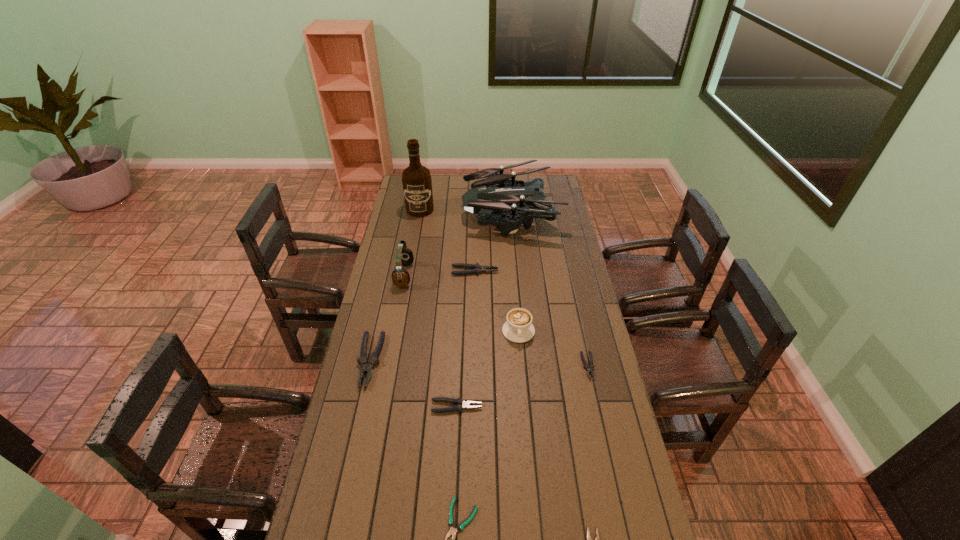
In order to click on blank area at the right edge in this screenshot , I will do `click(583, 279)`.

Locate an element on the screen. This screenshot has width=960, height=540. free space at the far left corner of the desktop is located at coordinates (401, 196).

At what (x,y) coordinates should I click in order to perform the action: click on vacant region between the drone and the fourth tallest object. Please return your answer as a coordinate pair (x, y). Looking at the image, I should click on (515, 272).

This screenshot has height=540, width=960. Identify the location of empty location between the drone and the cappuccino. (515, 272).

Image resolution: width=960 pixels, height=540 pixels. Find the location of `unoccupied position between the headset and the drone`. unoccupied position between the headset and the drone is located at coordinates (458, 244).

Image resolution: width=960 pixels, height=540 pixels. Identify the location of free area in between the nearest gray pliers and the alcohol. (439, 308).

Select which object appears as the seventh closest to the rightmost pliers. Please provide its 2D coordinates. Your answer should be formatted as a tuple, i.e. [(x, y)], where the tuple contains the x and y coordinates of a point satisfying the conditions above.

[(366, 365)]

In order to click on object identified as the fifth closest to the tallest pliers in this screenshot , I will do `click(518, 328)`.

Point out which pliers is positioned as the nearest to the tallest pliers. Please provide its 2D coordinates. Your answer should be formatted as a tuple, i.e. [(x, y)], where the tuple contains the x and y coordinates of a point satisfying the conditions above.

[(460, 404)]

Identify which pliers is located as the second nearest to the fourth shortest pliers. Please provide its 2D coordinates. Your answer should be formatted as a tuple, i.e. [(x, y)], where the tuple contains the x and y coordinates of a point satisfying the conditions above.

[(452, 531)]